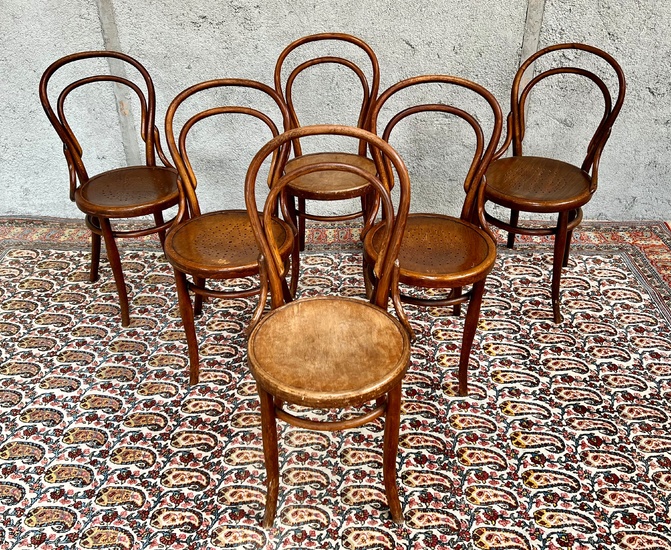
Locate an element on the screen. wood chair is located at coordinates (539, 192), (453, 240), (336, 326), (333, 183), (211, 224), (147, 182).